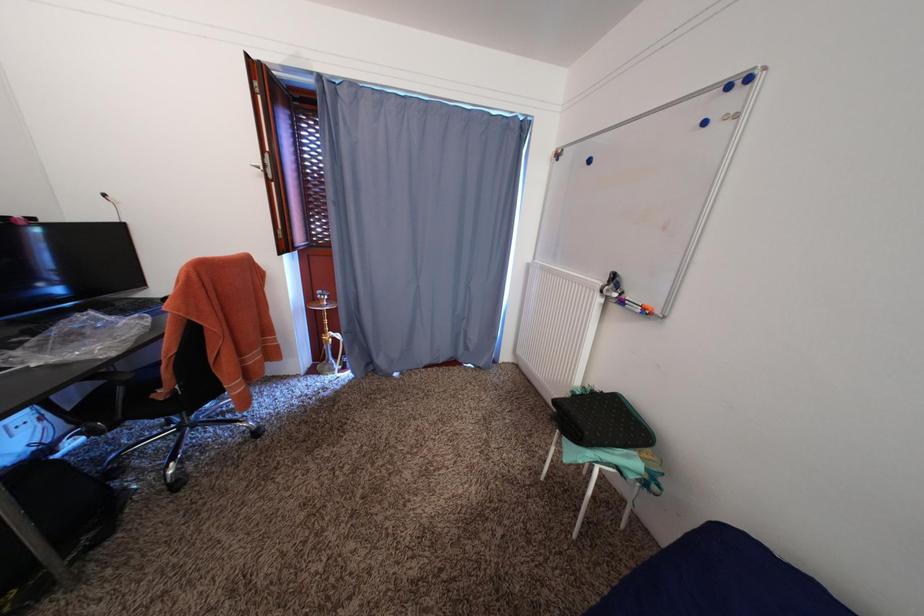
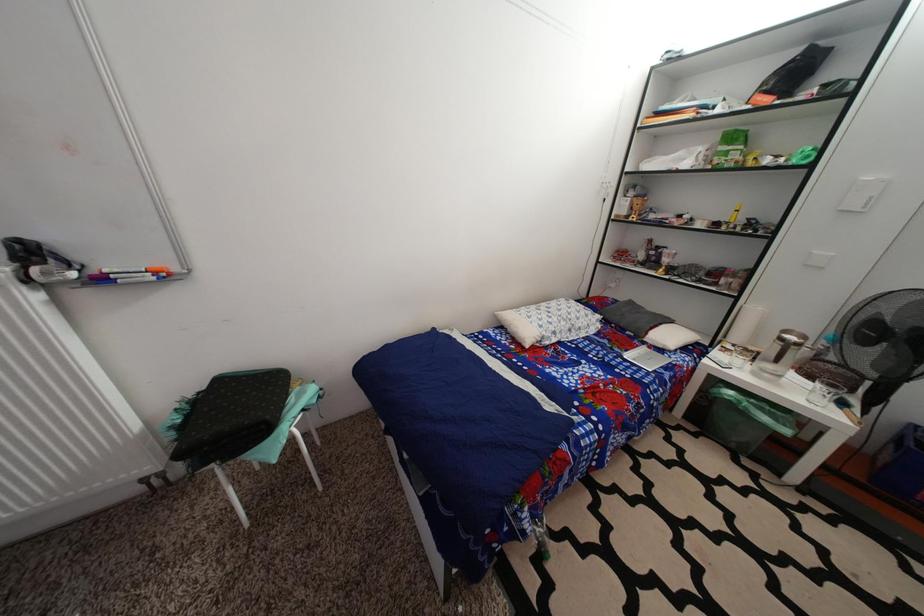
Based on the continuous images, in which direction is the camera rotating?

The camera rotated toward right-down.